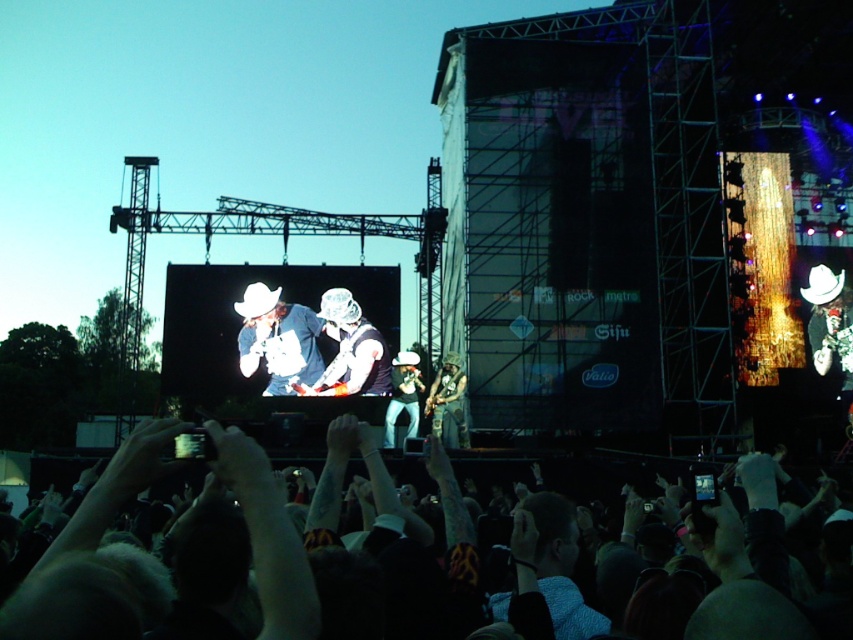
Measure the distance between matte white cowboy hat at center and camera.

They are 412.94 feet apart.

Find the location of a particular element. matte white cowboy hat at center is located at coordinates (279, 339).

Which is behind, point (302, 368) or point (416, 355)?

The point (416, 355) is behind.

The width and height of the screenshot is (853, 640). I want to click on matte white cowboy hat at center, so click(279, 339).

Between point (32, 570) and point (440, 410), which one is positioned in front?

Point (32, 570) is more forward.

Is point (82, 529) closer to camera compared to point (439, 380)?

Yes, it is in front of point (439, 380).

The image size is (853, 640). I want to click on dark skin crowd at lower center, so click(94, 560).

Between matte white cowboy hat at center and camouflage fabric guitar at center, which one has less height?

camouflage fabric guitar at center

From the picture: Measure the distance between point (251, 307) and camera.

Point (251, 307) is 130.77 meters away from camera.

You are a GUI agent. You are given a task and a screenshot of the screen. Output one action in this format:
    pyautogui.click(x=<x>, y=<y>)
    Task: Click on the matte white cowboy hat at center
    Image resolution: width=853 pixels, height=640 pixels.
    Given the screenshot: What is the action you would take?
    pyautogui.click(x=279, y=339)